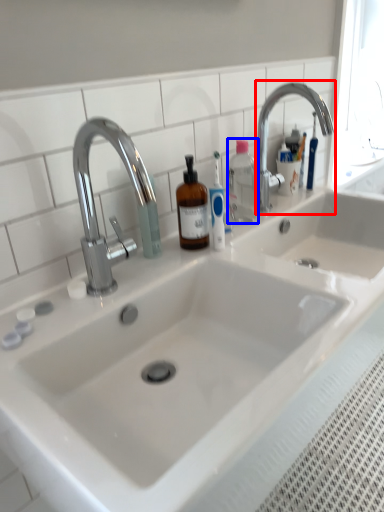
Question: Among these objects, which one is farthest to the camera, tap (highlighted by a red box) or bottle (highlighted by a blue box)?

Choices:
 (A) tap
 (B) bottle

Answer: (B)